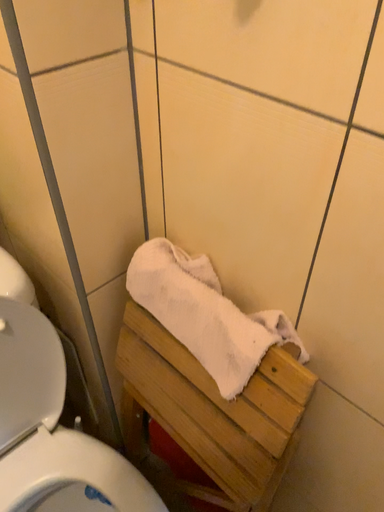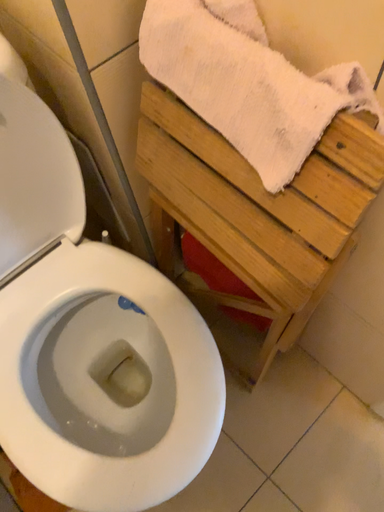
Question: How did the camera likely rotate when shooting the video?

Choices:
 (A) rotated downward
 (B) rotated upward

Answer: (A)